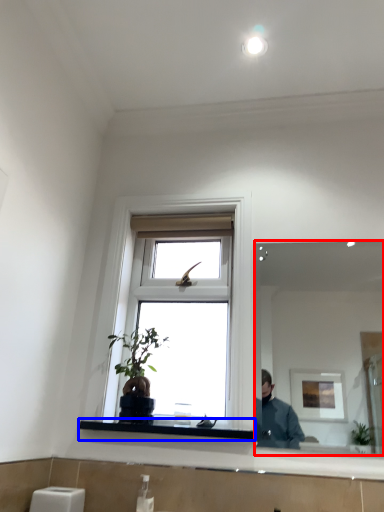
Question: Which of the following is the closest to the observer, mirror (highlighted by a red box) or window sill (highlighted by a blue box)?

Choices:
 (A) mirror
 (B) window sill

Answer: (A)